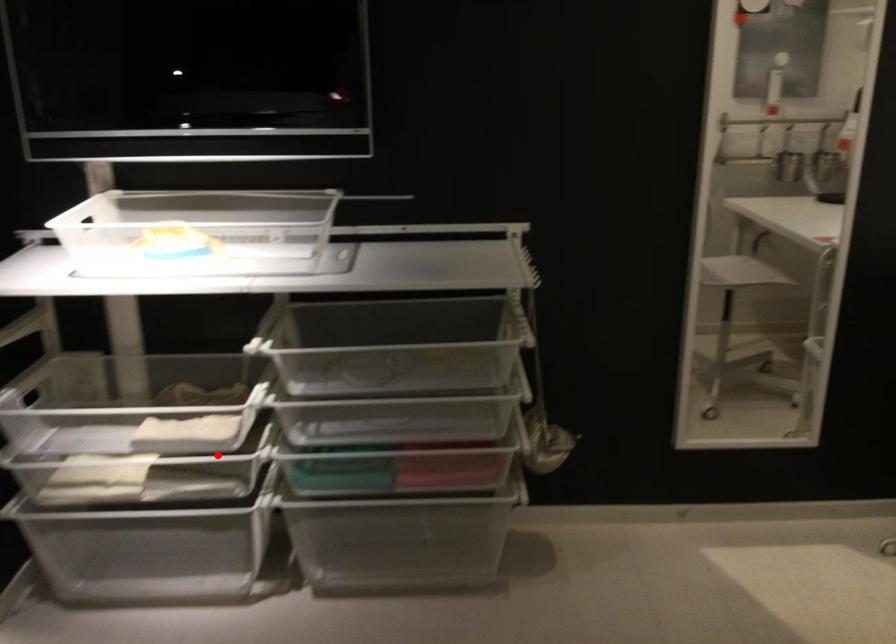
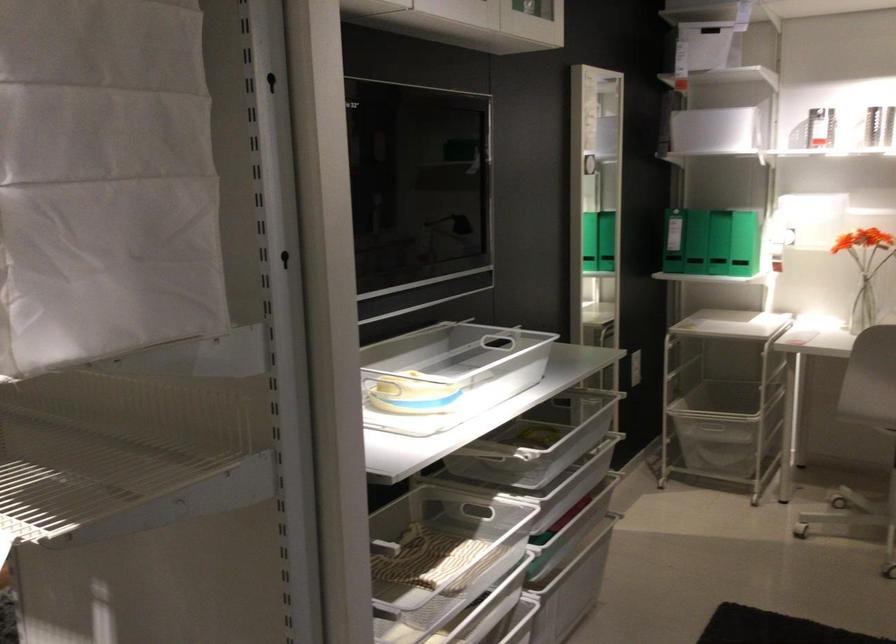
Find the pixel in the second image that matches the highlighted location in the first image.

(441, 544)